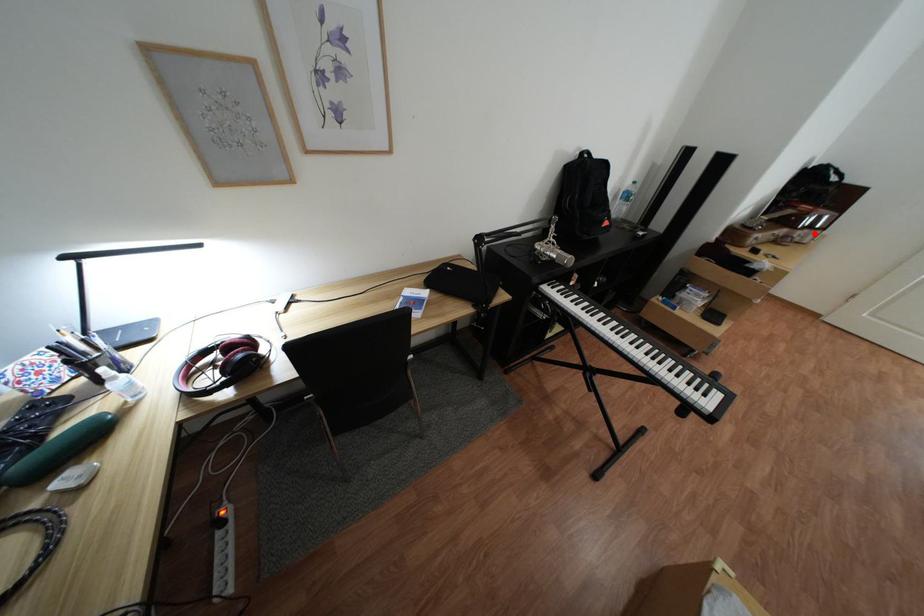
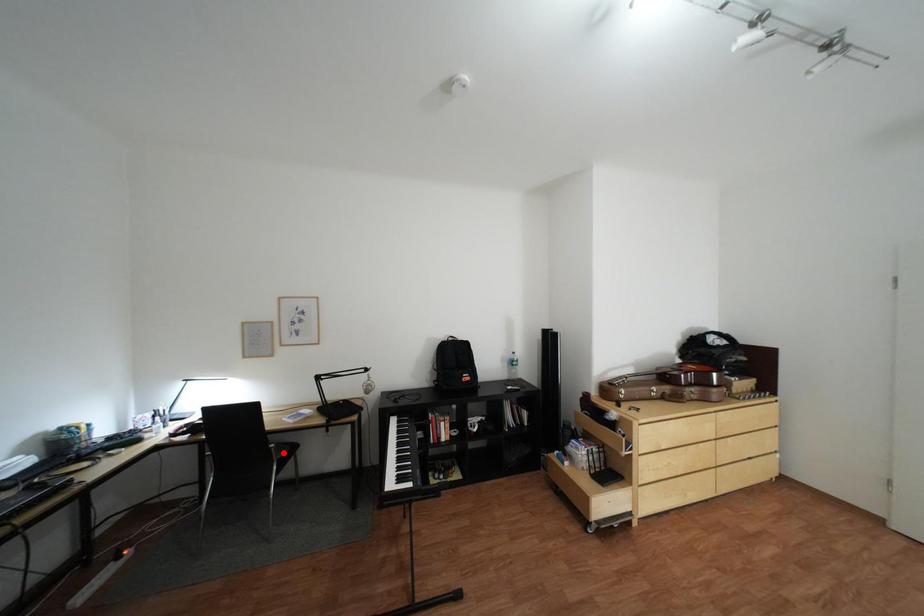
I am providing you with two images of the same scene from different viewpoints. A red point is marked on the first image and another point is marked on the second image. Is the red point in image1 aligned with the point shown in image2?

No